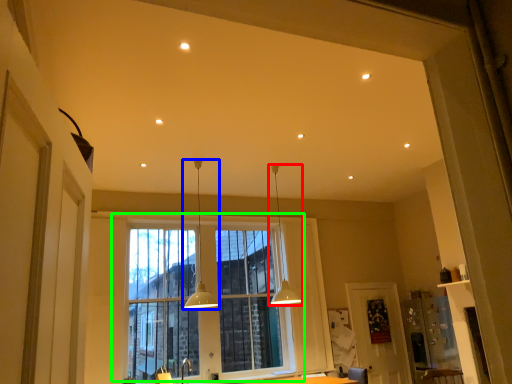
Question: Which object is the farthest from lamp (highlighted by a red box)? Choose among these: lamp (highlighted by a blue box) or window (highlighted by a green box).

Choices:
 (A) lamp
 (B) window

Answer: (A)